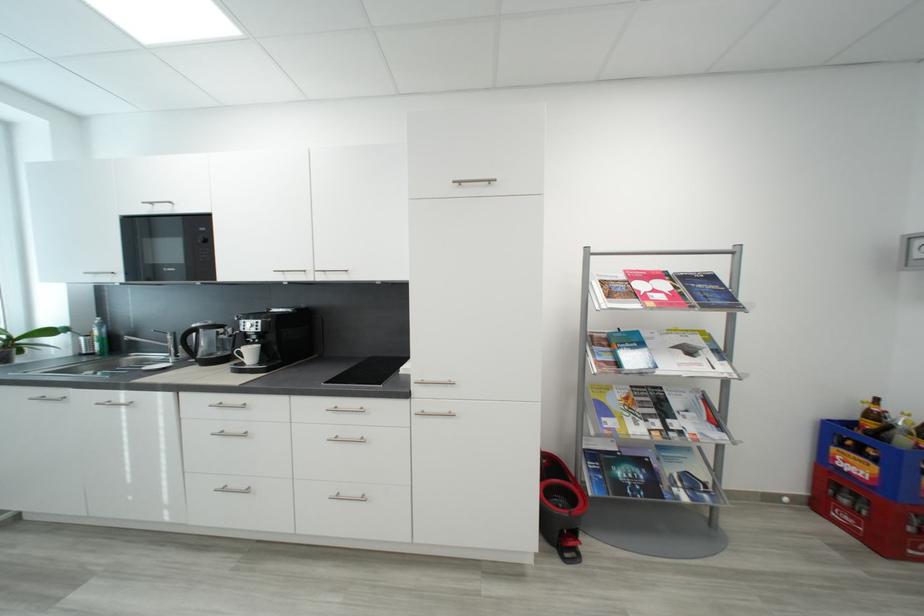
Where would you press the mop bucket pedal? Please return your answer as a coordinate pair (x, y).

(568, 549)